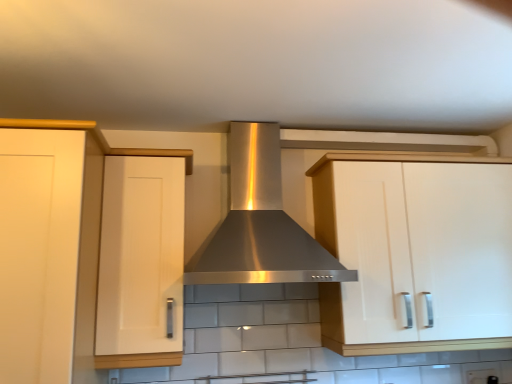
Question: Can you confirm if matte white cabinet at left, which is the 3th cabinetry from right to left, is bigger than stainless steel range hood at center?

Choices:
 (A) yes
 (B) no

Answer: (A)

Question: Does matte white cabinet at left, which appears as the 1th cabinetry when viewed from the left, come behind stainless steel range hood at center?

Choices:
 (A) yes
 (B) no

Answer: (B)

Question: Is matte white cabinet at left, which is the 3th cabinetry from right to left, looking in the opposite direction of stainless steel range hood at center?

Choices:
 (A) yes
 (B) no

Answer: (B)

Question: From a real-world perspective, is matte white cabinet at left, which appears as the 1th cabinetry when viewed from the left, beneath stainless steel range hood at center?

Choices:
 (A) no
 (B) yes

Answer: (B)

Question: Is matte white cabinet at left, which appears as the 1th cabinetry when viewed from the left, to the right of stainless steel range hood at center from the viewer's perspective?

Choices:
 (A) no
 (B) yes

Answer: (A)

Question: From the image's perspective, would you say matte white cabinet at left, which is the 3th cabinetry from right to left, is shown under stainless steel range hood at center?

Choices:
 (A) yes
 (B) no

Answer: (A)

Question: Considering the relative sizes of white glossy cabinet at right, the third cabinetry from the left, and matte white cabinet at left, which is the 3th cabinetry from right to left, in the image provided, is white glossy cabinet at right, the third cabinetry from the left, wider than matte white cabinet at left, which is the 3th cabinetry from right to left,?

Choices:
 (A) yes
 (B) no

Answer: (B)

Question: Is matte white cabinet at left, which is the 3th cabinetry from right to left, inside white glossy cabinet at right, the third cabinetry from the left?

Choices:
 (A) no
 (B) yes

Answer: (A)

Question: Considering the relative sizes of white glossy cabinet at right, the third cabinetry from the left, and matte white cabinet at left, which appears as the 1th cabinetry when viewed from the left, in the image provided, is white glossy cabinet at right, the third cabinetry from the left, taller than matte white cabinet at left, which appears as the 1th cabinetry when viewed from the left,?

Choices:
 (A) no
 (B) yes

Answer: (A)

Question: Are white glossy cabinet at right, positioned as the first cabinetry in right-to-left order, and matte white cabinet at left, which appears as the 1th cabinetry when viewed from the left, beside each other?

Choices:
 (A) yes
 (B) no

Answer: (B)

Question: Would you consider white glossy cabinet at right, the third cabinetry from the left, to be distant from matte white cabinet at left, which is the 3th cabinetry from right to left?

Choices:
 (A) yes
 (B) no

Answer: (A)

Question: From the image's perspective, does white glossy cabinet at right, the third cabinetry from the left, appear higher than matte white cabinet at left, which is the 3th cabinetry from right to left?

Choices:
 (A) no
 (B) yes

Answer: (B)

Question: Does matte white cabinet at left, which is the 3th cabinetry from right to left, have a smaller size compared to white matte cabinet at left, the 2th cabinetry positioned from the right?

Choices:
 (A) yes
 (B) no

Answer: (B)